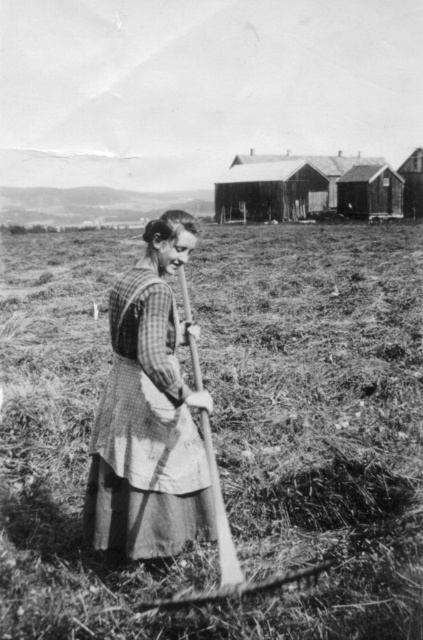
Question: Can you confirm if dry grass at center is smaller than wooden hut at upper right?

Choices:
 (A) no
 (B) yes

Answer: (A)

Question: Which object is closer to the camera taking this photo?

Choices:
 (A) dry grass at center
 (B) wooden hut at center

Answer: (A)

Question: Observing the image, what is the correct spatial positioning of dry grass at center in reference to checkered fabric dress at center?

Choices:
 (A) below
 (B) above

Answer: (B)

Question: From the image, what is the correct spatial relationship of checkered fabric dress at center in relation to wooden hut at center?

Choices:
 (A) above
 (B) below

Answer: (B)

Question: Among these objects, which one is farthest from the camera?

Choices:
 (A) wooden hut at center
 (B) dry grass at center
 (C) checkered fabric dress at center
 (D) wooden hut at upper right

Answer: (D)

Question: Which point is farther to the camera?

Choices:
 (A) checkered fabric dress at center
 (B) dry grass at center
 (C) wooden hut at upper right

Answer: (C)